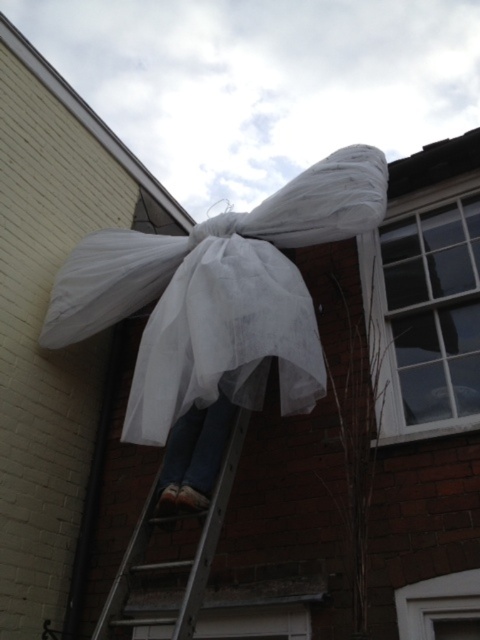
You are a painter needing to reach the top of the silver metallic ladder at center to touch up the building exterior. Can you reach the white sheer fabric at upper center from the top of the ladder?

The white sheer fabric at upper center is much taller than the silver metallic ladder at center, so the ladder is not tall enough to reach it.

In the scene shown: You are a painter standing on the silver metallic ladder at center, looking up. Can you see the white sheer fabric at upper center above you?

The white sheer fabric at upper center is further to the viewer than the silver metallic ladder at center, so from your position on the ladder, you are behind the fabric and cannot see it above you.

Consider the image. You are a contractor assessing the building facade. You notice the white sheer fabric at upper center. Where exactly is it positioned relative to the building structure?

The white sheer fabric at upper center is positioned at coordinates point [219,296] on the building structure.